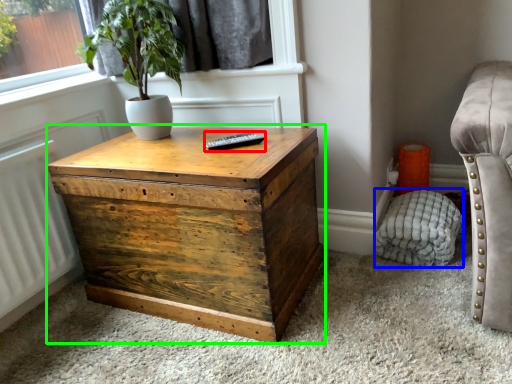
Question: Which object is the farthest from remote (highlighted by a red box)? Choose among these: swivel chair (highlighted by a blue box) or nightstand (highlighted by a green box).

Choices:
 (A) swivel chair
 (B) nightstand

Answer: (A)